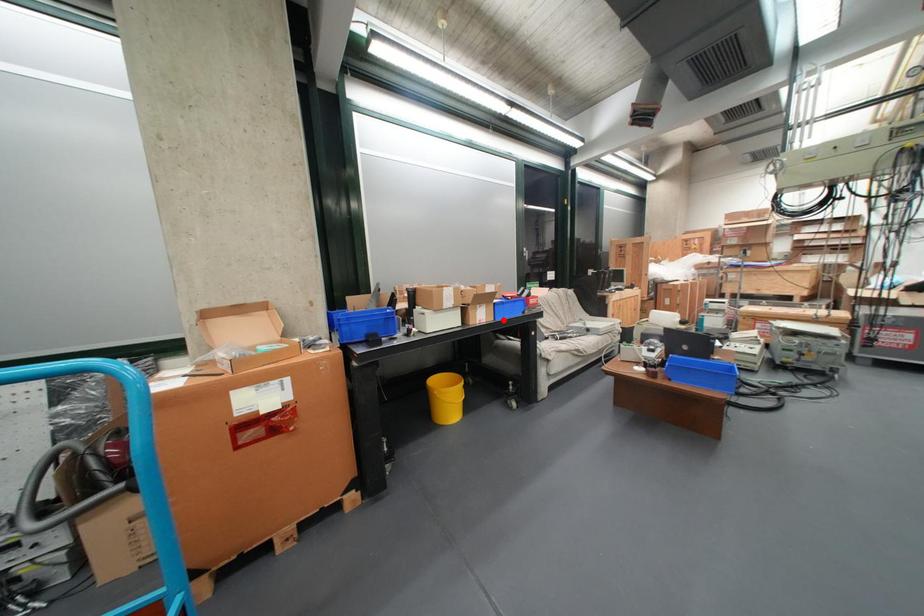
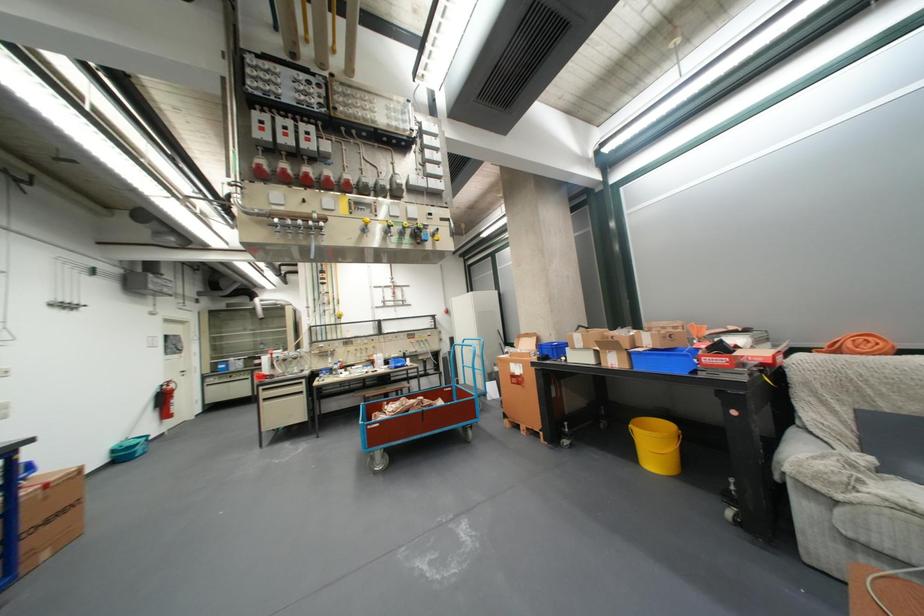
Find the pixel in the second image that matches the highlighted location in the first image.

(638, 368)